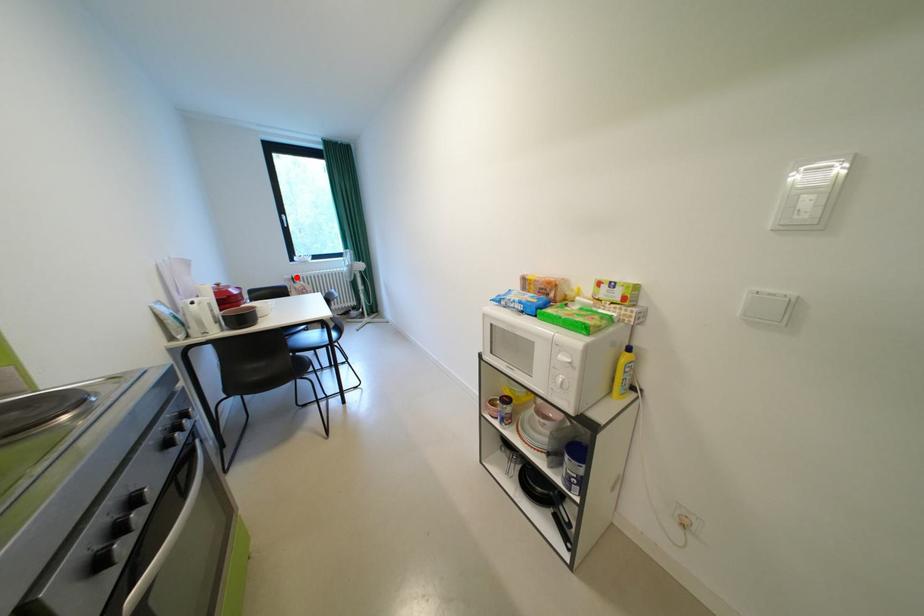
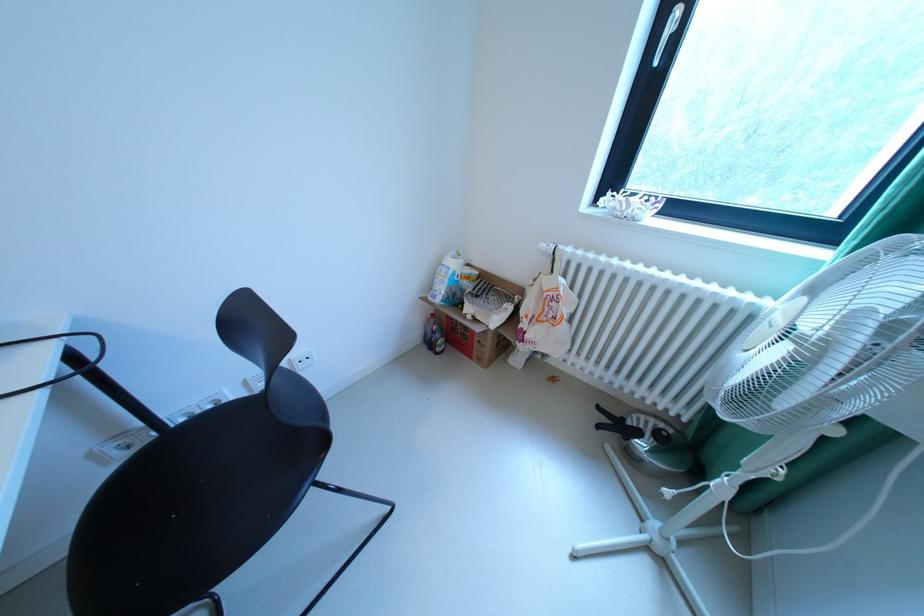
Find the pixel in the second image that matches the highlighted location in the first image.

(553, 246)